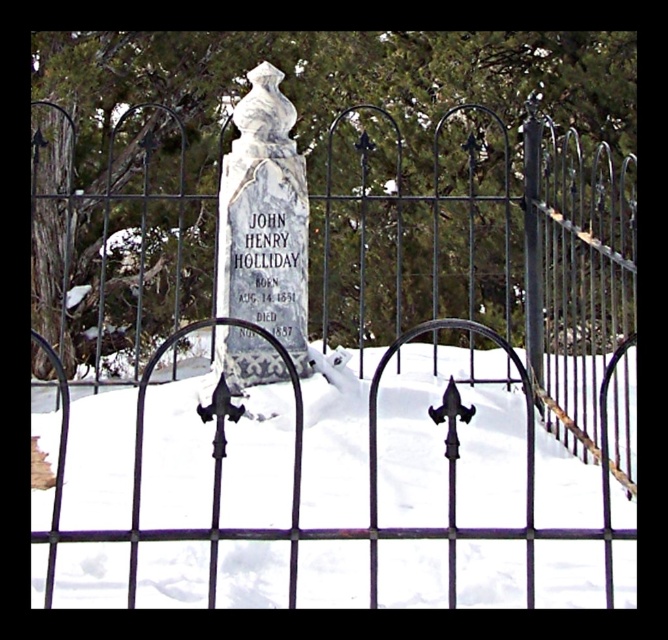
Question: Which point is closer to the camera taking this photo?

Choices:
 (A) (293, 314)
 (B) (532, 426)

Answer: (B)

Question: Considering the relative positions of black wrought iron gate at center and white marble gravestone at center in the image provided, where is black wrought iron gate at center located with respect to white marble gravestone at center?

Choices:
 (A) right
 (B) left

Answer: (A)

Question: Does black wrought iron gate at center come behind white marble gravestone at center?

Choices:
 (A) no
 (B) yes

Answer: (A)

Question: Which object is farther from the camera taking this photo?

Choices:
 (A) black wrought iron gate at center
 (B) white marble gravestone at center

Answer: (B)

Question: Is black wrought iron gate at center positioned before white marble gravestone at center?

Choices:
 (A) yes
 (B) no

Answer: (A)